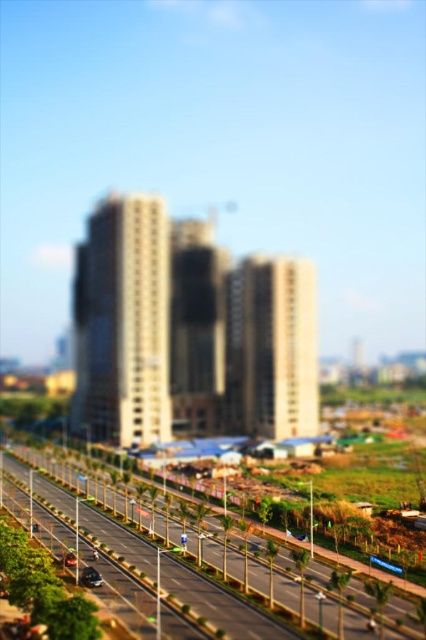
You are standing at the pedestrian walkway and see two shiny black cars in the road. Which shiny black car is closer to the median strip between the shiny black car at lower left and the shiny black car at center?

The shiny black car at center is closer to the median strip because the shiny black car at lower left is positioned to its right, meaning it is further away from the median strip.